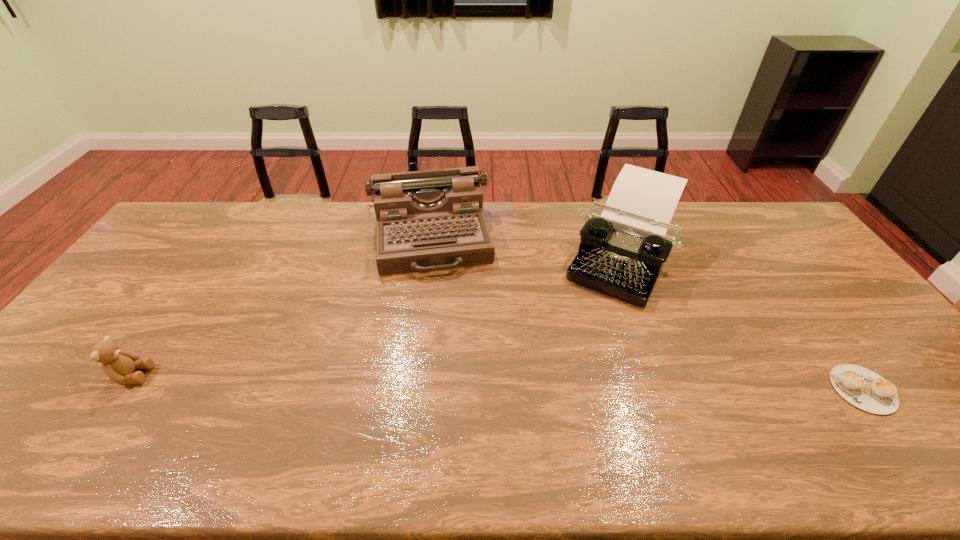
Locate which object is the third closest to the leftmost object. Please provide its 2D coordinates. Your answer should be formatted as a tuple, i.e. [(x, y)], where the tuple contains the x and y coordinates of a point satisfying the conditions above.

[(863, 388)]

Identify which object is located as the second nearest to the leftmost object. Please provide its 2D coordinates. Your answer should be formatted as a tuple, i.e. [(x, y)], where the tuple contains the x and y coordinates of a point satisfying the conditions above.

[(622, 251)]

At what (x,y) coordinates should I click in order to perform the action: click on vacant region that satisfies the following two spatial constraints: 1. on the front side of the rightmost object; 2. on the right side of the left typewriter. Please return your answer as a coordinate pair (x, y). The width and height of the screenshot is (960, 540). Looking at the image, I should click on (410, 389).

Find the location of a particular element. vacant space that satisfies the following two spatial constraints: 1. on the front side of the second object from right to left; 2. on the left side of the cappuccino is located at coordinates (670, 389).

Locate an element on the screen. vacant space that satisfies the following two spatial constraints: 1. on the front side of the second object from right to left; 2. on the left side of the rightmost object is located at coordinates (670, 389).

You are a GUI agent. You are given a task and a screenshot of the screen. Output one action in this format:
    pyautogui.click(x=<x>, y=<y>)
    Task: Click on the free region that satisfies the following two spatial constraints: 1. on the front side of the right typewriter; 2. on the left side of the cappuccino
    This screenshot has width=960, height=540.
    Given the screenshot: What is the action you would take?
    pyautogui.click(x=670, y=389)

Image resolution: width=960 pixels, height=540 pixels. Identify the location of vacant region that satisfies the following two spatial constraints: 1. on the front side of the second object from left to right; 2. on the left side of the shortest object. (410, 389).